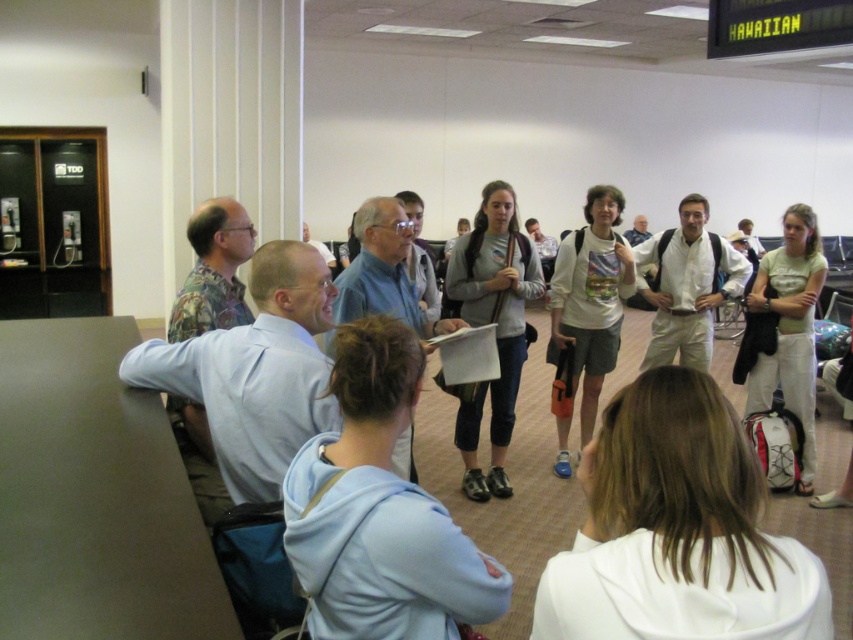
Question: Which point is farther to the camera?

Choices:
 (A) gray cotton hoodie at center
 (B) white cotton hoodie at center

Answer: (A)

Question: Is white cotton hoodie at center thinner than gray cotton hoodie at center?

Choices:
 (A) no
 (B) yes

Answer: (B)

Question: Which point is closer to the camera?

Choices:
 (A) white cotton hoodie at center
 (B) gray cotton hoodie at center

Answer: (A)

Question: Can you confirm if white cotton hoodie at center is positioned to the left of gray cotton hoodie at center?

Choices:
 (A) yes
 (B) no

Answer: (B)

Question: Is white cotton hoodie at center above gray cotton hoodie at center?

Choices:
 (A) yes
 (B) no

Answer: (B)

Question: Which point is farther to the camera?

Choices:
 (A) white cotton hoodie at center
 (B) gray cotton hoodie at center

Answer: (B)